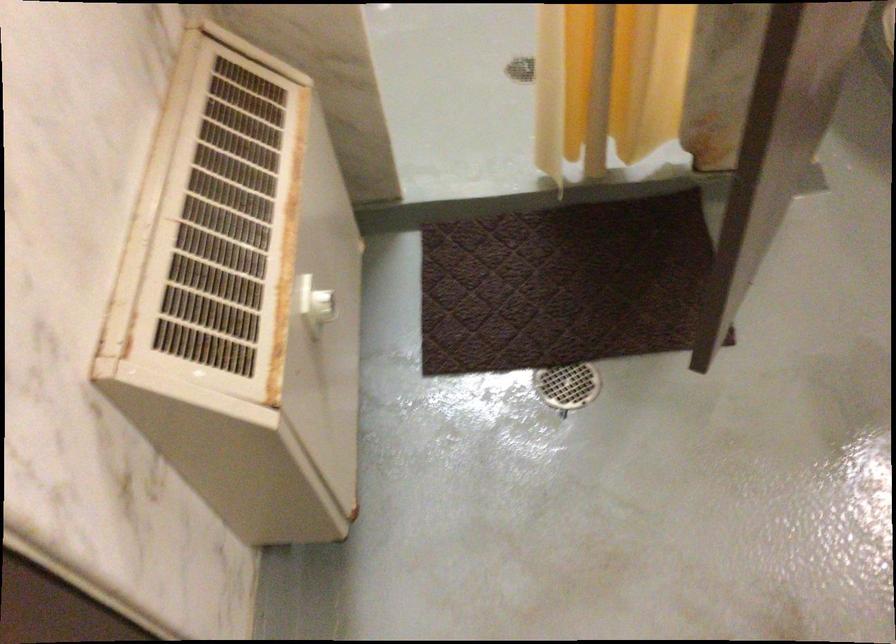
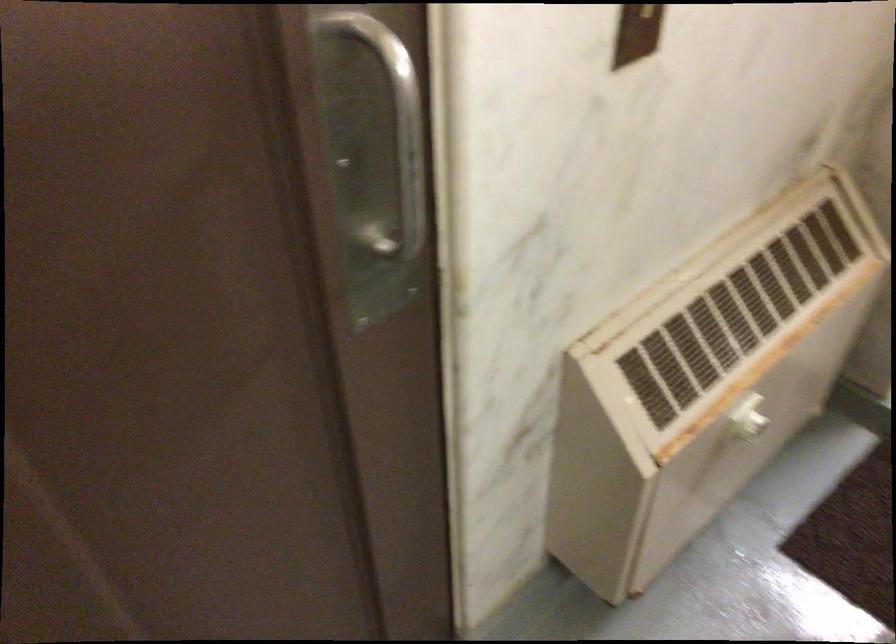
The point at (x=321, y=305) is marked in the first image. Where is the corresponding point in the second image?

(746, 418)